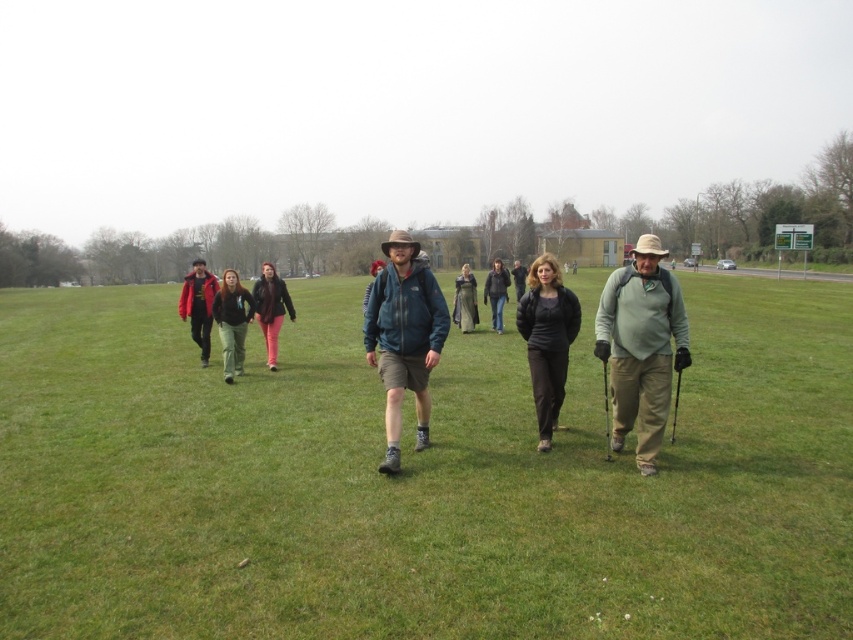
Can you confirm if green fabric jacket at center is bigger than dark gray wool sweater at center?

Correct, green fabric jacket at center is larger in size than dark gray wool sweater at center.

Does green fabric jacket at center have a greater width compared to dark gray wool sweater at center?

Correct, the width of green fabric jacket at center exceeds that of dark gray wool sweater at center.

Looking at this image, who is more forward, (636, 452) or (471, 305)?

Positioned in front is point (636, 452).

This screenshot has height=640, width=853. I want to click on green fabric jacket at center, so click(x=641, y=346).

Between black matte jacket at center and dark gray jacket at center, which one has more height?

dark gray jacket at center

Between black matte jacket at center and dark gray jacket at center, which one appears on the right side from the viewer's perspective?

Positioned to the right is dark gray jacket at center.

The image size is (853, 640). What do you see at coordinates (547, 339) in the screenshot?
I see `black matte jacket at center` at bounding box center [547, 339].

The height and width of the screenshot is (640, 853). Find the location of `black matte jacket at center`. black matte jacket at center is located at coordinates (547, 339).

Can you confirm if green grass at center is positioned above matte pink pants at center?

Indeed, green grass at center is positioned over matte pink pants at center.

Describe the element at coordinates (418, 477) in the screenshot. The image size is (853, 640). I see `green grass at center` at that location.

Find the location of `green grass at center`. green grass at center is located at coordinates (418, 477).